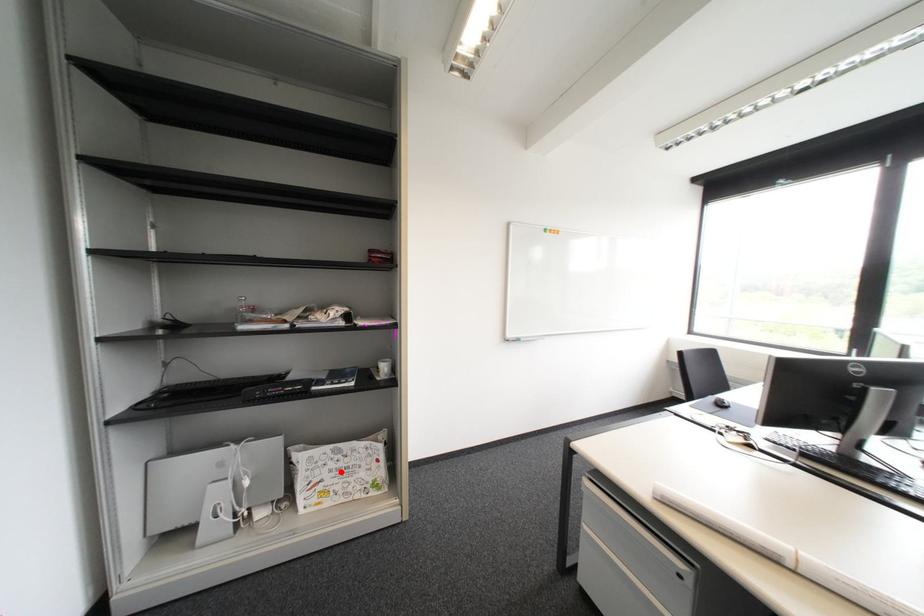
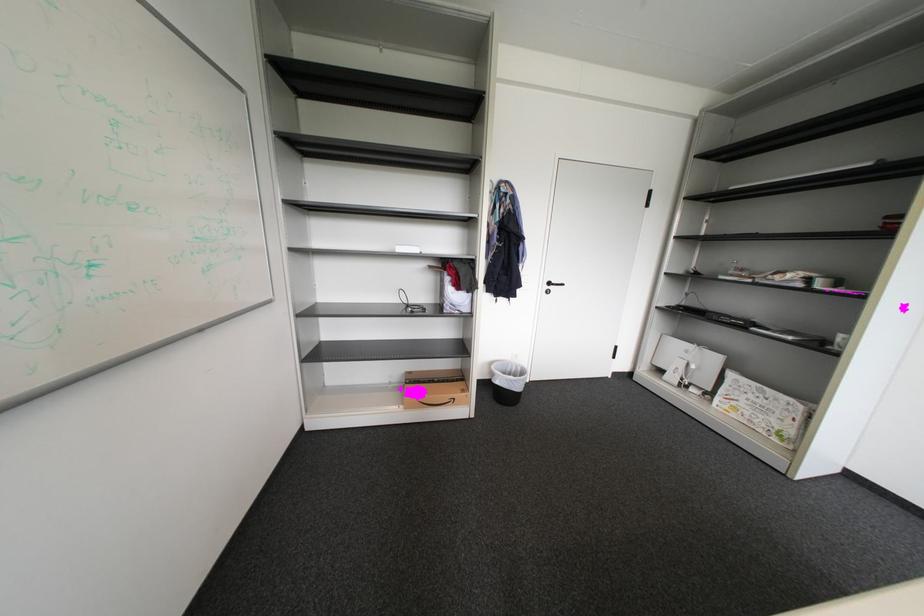
The point at the highlighted location is marked in the first image. Where is the corresponding point in the second image?

(758, 400)